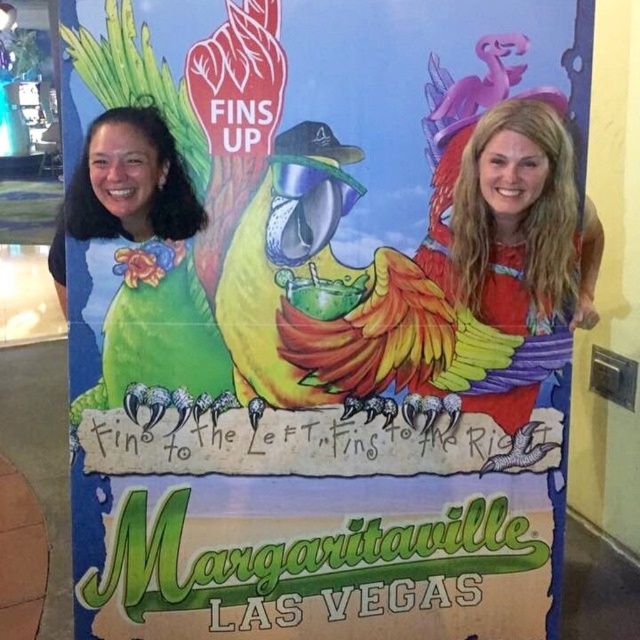
Question: Among these objects, which one is nearest to the camera?

Choices:
 (A) green matte parrot at left
 (B) shiny metallic parrot at center
 (C) blonde hair at right

Answer: (C)

Question: Is shiny metallic parrot at center further to camera compared to blonde hair at right?

Choices:
 (A) no
 (B) yes

Answer: (B)

Question: Is the position of shiny metallic parrot at center less distant than that of blonde hair at right?

Choices:
 (A) no
 (B) yes

Answer: (A)

Question: Considering the relative positions of shiny metallic parrot at center and blonde hair at right in the image provided, where is shiny metallic parrot at center located with respect to blonde hair at right?

Choices:
 (A) above
 (B) below

Answer: (B)

Question: Which of the following is the farthest from the observer?

Choices:
 (A) shiny metallic parrot at center
 (B) green matte parrot at left
 (C) blonde hair at right

Answer: (A)

Question: Which of the following is the closest to the observer?

Choices:
 (A) (186, 252)
 (B) (253, 285)
 (C) (586, 298)

Answer: (A)